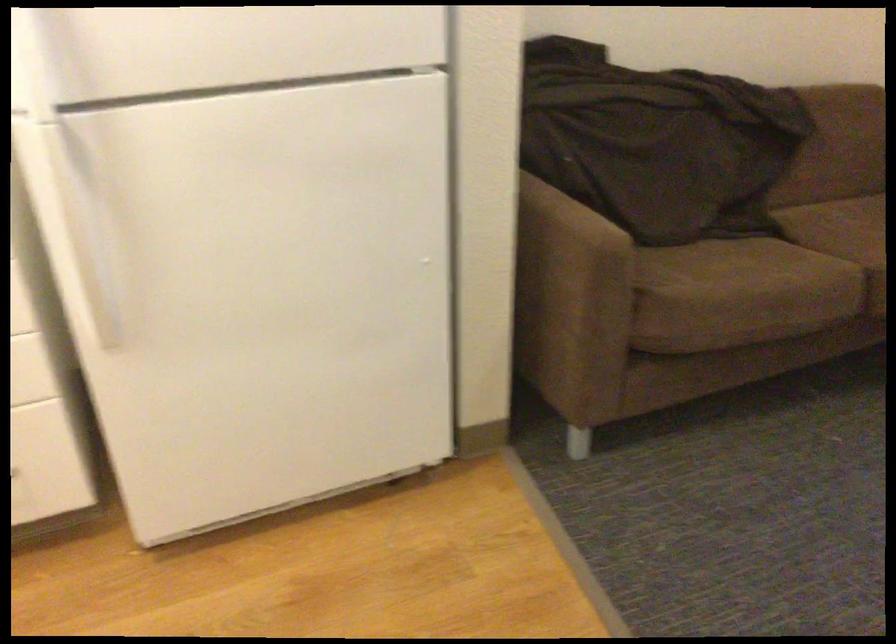
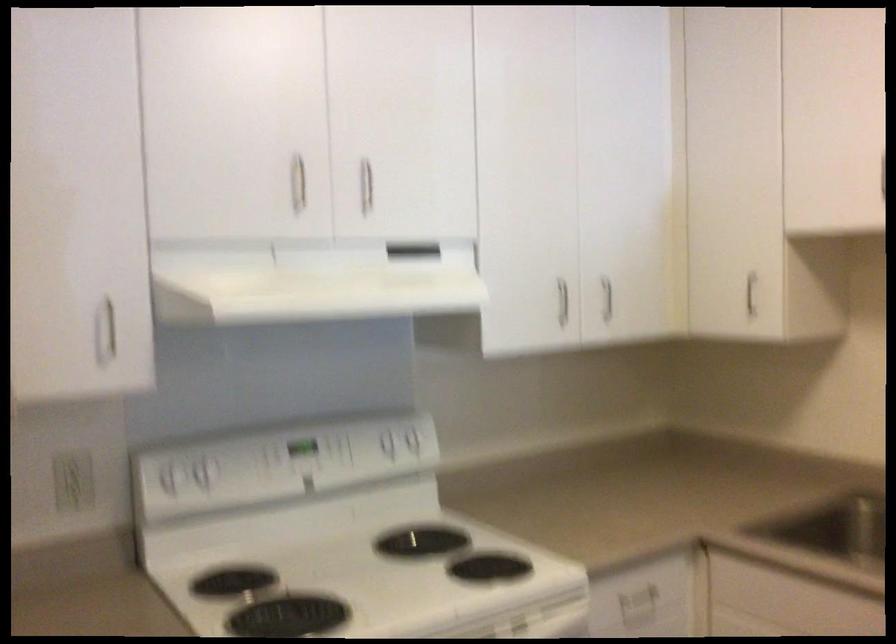
Question: How did the camera likely rotate?

Choices:
 (A) Left
 (B) Right
 (C) Up
 (D) Down

Answer: (A)